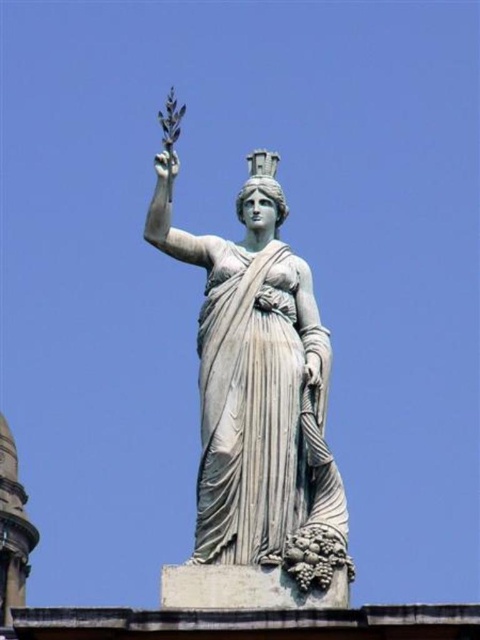
In the scene shown: Can you confirm if white marble statue at center is taller than matte gray hand at center?

Correct, white marble statue at center is much taller as matte gray hand at center.

Can you confirm if white marble statue at center is positioned to the left of matte gray hand at center?

Yes, white marble statue at center is to the left of matte gray hand at center.

What do you see at coordinates (260, 394) in the screenshot?
I see `white marble statue at center` at bounding box center [260, 394].

Image resolution: width=480 pixels, height=640 pixels. What are the coordinates of `white marble statue at center` in the screenshot? It's located at (260, 394).

Does white marble hand at upper left have a lesser width compared to matte gray hand at center?

No, white marble hand at upper left is not thinner than matte gray hand at center.

Which is above, white marble hand at upper left or matte gray hand at center?

white marble hand at upper left is above.

Is point (168, 177) less distant than point (312, 371)?

No, (168, 177) is further to viewer.

You are a GUI agent. You are given a task and a screenshot of the screen. Output one action in this format:
    pyautogui.click(x=<x>, y=<y>)
    Task: Click on the white marble hand at upper left
    The image size is (480, 640).
    Given the screenshot: What is the action you would take?
    pos(166,164)

Does point (305, 492) come behind point (168, 177)?

No.

The width and height of the screenshot is (480, 640). Describe the element at coordinates (260, 394) in the screenshot. I see `white marble statue at center` at that location.

What are the coordinates of `white marble statue at center` in the screenshot? It's located at (260, 394).